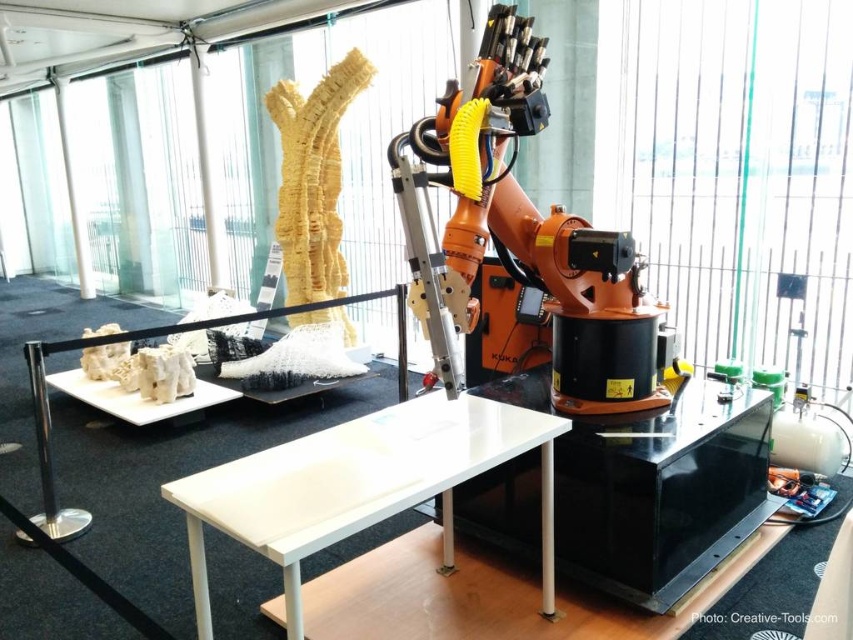
Is black glossy table at center closer to camera compared to white glossy table at center?

No, it is not.

Is black glossy table at center taller than white glossy table at center?

No, black glossy table at center is not taller than white glossy table at center.

Does point (474, 522) come in front of point (282, 518)?

No.

Identify the location of black glossy table at center. (660, 492).